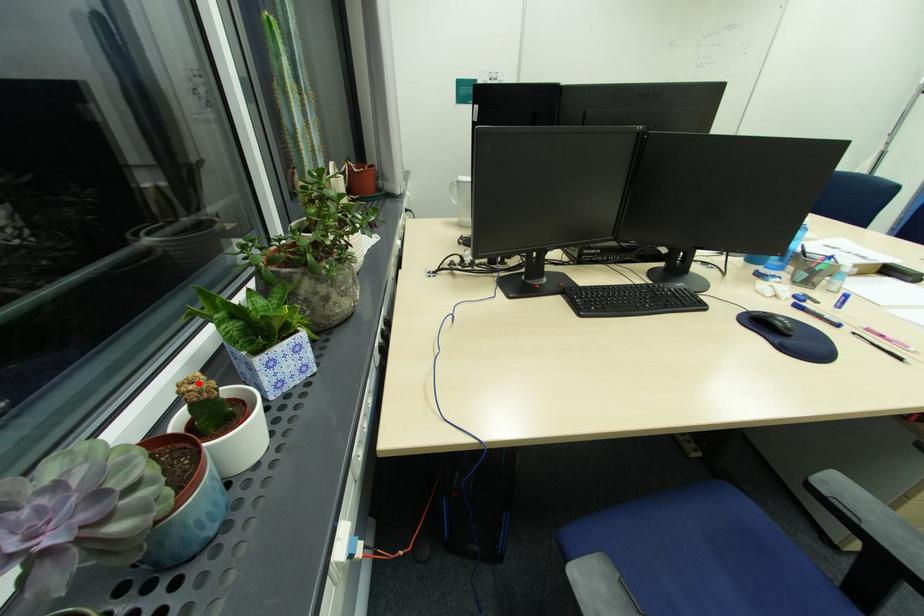
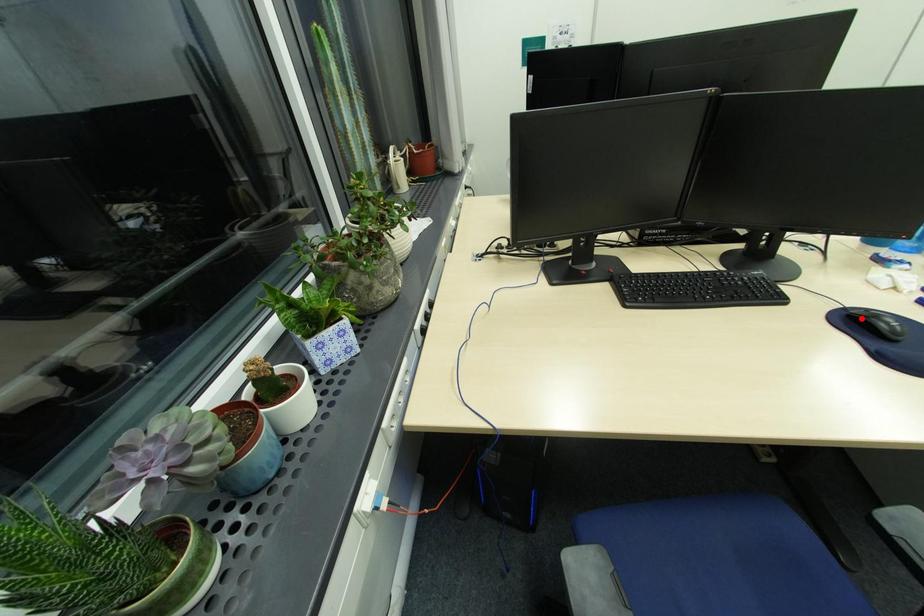
I am providing you with two images of the same scene from different viewpoints. A red point is marked on the first image and another point is marked on the second image. Does the point marked in image1 correspond to the same location as the one in image2?

No